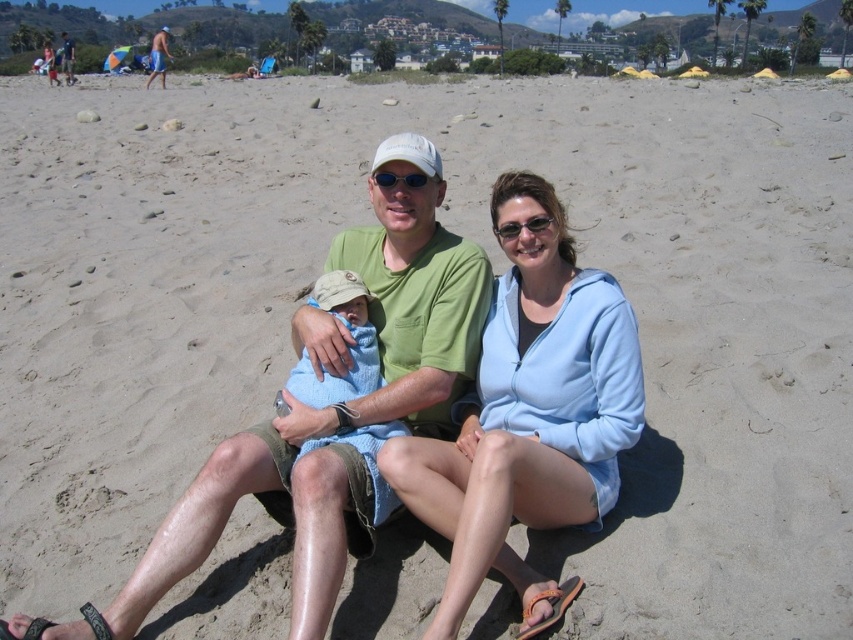
Does light blue fleece jacket at center appear on the right side of blue shorts at upper left?

Correct, you'll find light blue fleece jacket at center to the right of blue shorts at upper left.

Is point (485, 529) farther from viewer compared to point (154, 58)?

No, (485, 529) is in front of (154, 58).

In order to click on light blue fleece jacket at center in this screenshot , I will do (x=529, y=413).

Between blue shorts at upper left and matte white sunglasses at center, which one appears on the left side from the viewer's perspective?

From the viewer's perspective, blue shorts at upper left appears more on the left side.

Can you confirm if blue shorts at upper left is positioned below matte white sunglasses at center?

No, blue shorts at upper left is not below matte white sunglasses at center.

What do you see at coordinates (158, 56) in the screenshot? I see `blue shorts at upper left` at bounding box center [158, 56].

Image resolution: width=853 pixels, height=640 pixels. What are the coordinates of `blue shorts at upper left` in the screenshot? It's located at (158, 56).

This screenshot has height=640, width=853. Describe the element at coordinates (529, 413) in the screenshot. I see `light blue fleece jacket at center` at that location.

Who is more forward, (627, 376) or (381, 172)?

Point (627, 376)

What are the coordinates of `light blue fleece jacket at center` in the screenshot? It's located at (529, 413).